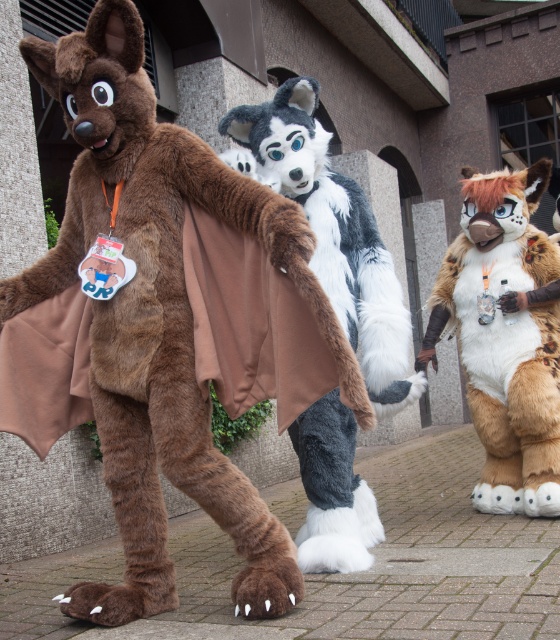
Find the location of `fluffy fur wolf at center`. fluffy fur wolf at center is located at coordinates (332, 232).

Does point (375, 390) lie in front of point (530, 417)?

Yes, it is.

Which is in front, point (366, 218) or point (529, 195)?

Point (366, 218)

Where is `fluffy fur wolf at center`? Image resolution: width=560 pixels, height=640 pixels. fluffy fur wolf at center is located at coordinates (332, 232).

Who is lower down, brown furry costume at left or fluffy fur wolf at center?

Positioned lower is fluffy fur wolf at center.

Is point (91, 124) positioned after point (324, 420)?

No, (91, 124) is in front of (324, 420).

This screenshot has height=640, width=560. Identify the location of brown furry costume at left. (164, 323).

The image size is (560, 640). I want to click on brown furry costume at left, so click(x=164, y=323).

Does brown furry costume at left have a smaller size compared to fluffy brown fur at center?

No.

Is brown furry costume at left thinner than fluffy brown fur at center?

Incorrect, brown furry costume at left's width is not less than fluffy brown fur at center's.

Where is `brown furry costume at left`? brown furry costume at left is located at coordinates (164, 323).

This screenshot has height=640, width=560. In order to click on brown furry costume at left in this screenshot , I will do point(164,323).